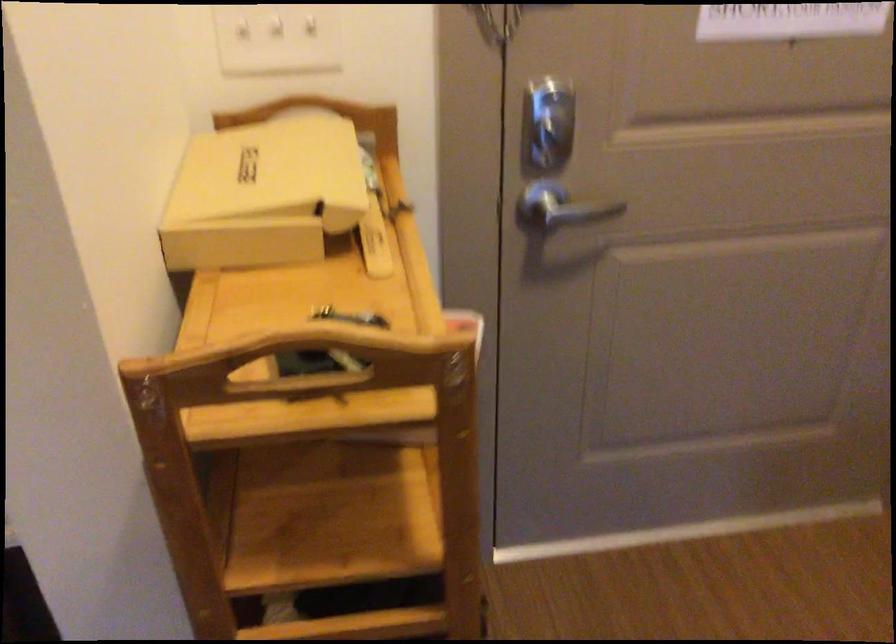
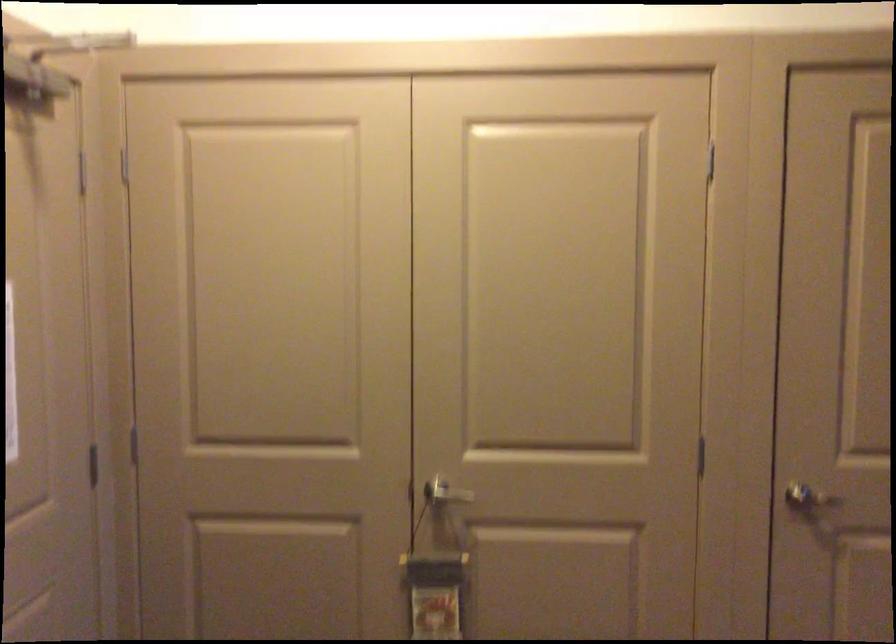
Question: The first image is from the beginning of the video and the second image is from the end. How did the camera likely rotate when shooting the video?

Choices:
 (A) Left
 (B) Right
 (C) Up
 (D) Down

Answer: (B)